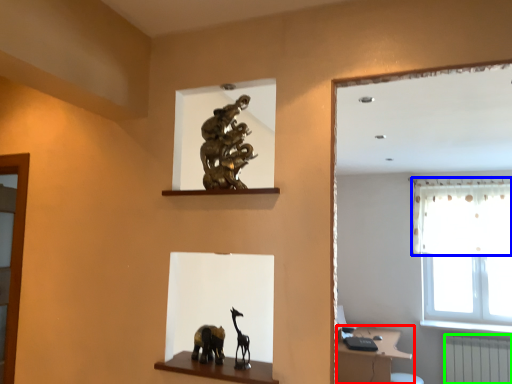
Question: Which object is the farthest from vanity (highlighted by a red box)? Choose among these: curtain (highlighted by a blue box) or radiator (highlighted by a green box).

Choices:
 (A) curtain
 (B) radiator

Answer: (A)